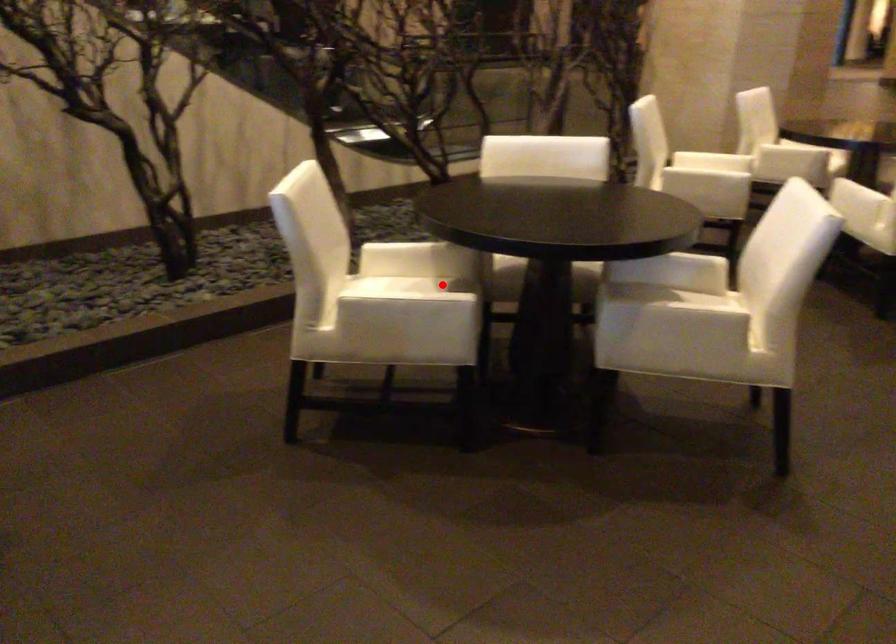
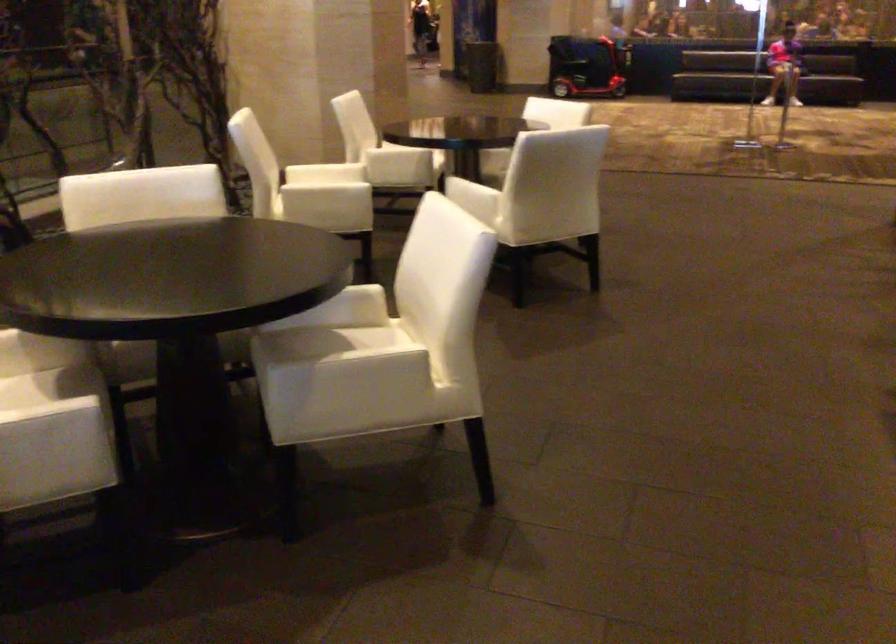
Question: I am providing you with two images of the same scene from different viewpoints. Image1 has a red point marked. In image2, the corresponding 3D location appears at what relative position? Reply with the corresponding letter.

Choices:
 (A) Closer
 (B) Farther

Answer: (A)